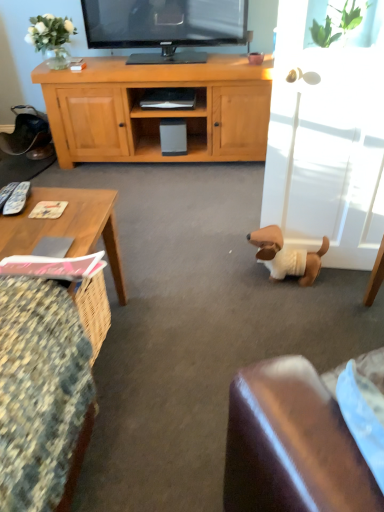
Identify the location of blank area to the left of white glossy glass door at right. (235, 270).